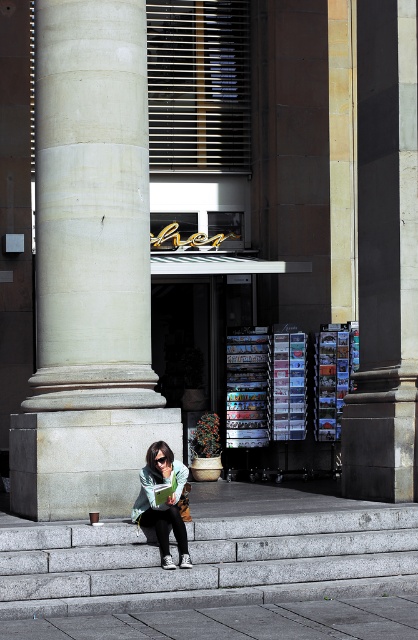
Question: Is gray concrete stairs at lower left behind green fabric scarf at lower center?

Choices:
 (A) no
 (B) yes

Answer: (A)

Question: Which of the following is the farthest from the observer?

Choices:
 (A) white marble column at center
 (B) gray concrete stairs at lower left
 (C) green fabric scarf at lower center

Answer: (A)

Question: Does white marble column at center have a smaller size compared to gray concrete stairs at lower left?

Choices:
 (A) yes
 (B) no

Answer: (A)

Question: Is white marble column at center to the left of gray concrete stairs at lower left from the viewer's perspective?

Choices:
 (A) no
 (B) yes

Answer: (B)

Question: Considering the real-world distances, which object is farthest from the green fabric scarf at lower center?

Choices:
 (A) gray concrete stairs at lower left
 (B) white marble column at center

Answer: (B)

Question: Estimate the real-world distances between objects in this image. Which object is farther from the white marble column at center?

Choices:
 (A) gray concrete stairs at lower left
 (B) green fabric scarf at lower center

Answer: (A)